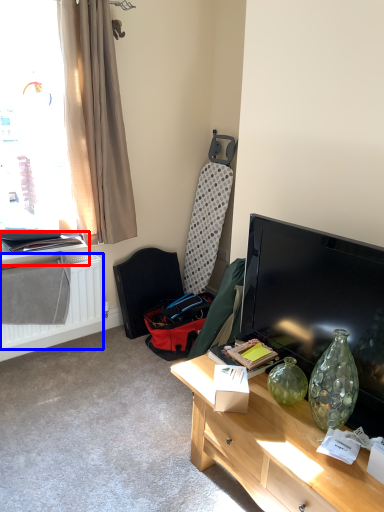
Question: Which of the following is the closest to the observer, window sill (highlighted by a red box) or radiator (highlighted by a blue box)?

Choices:
 (A) window sill
 (B) radiator

Answer: (B)